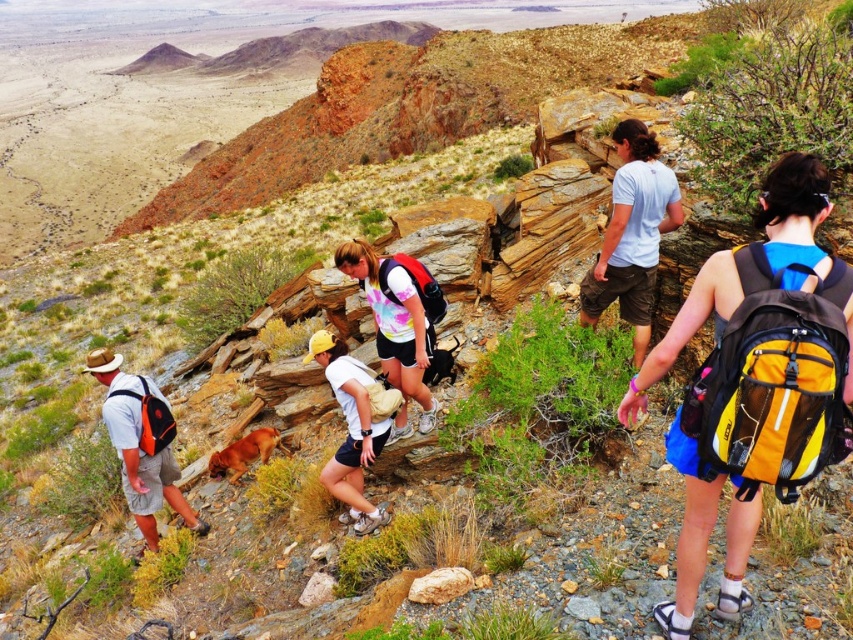
Consider the image. Is light blue t-shirt at upper right above white fabric shirt at center?

Correct, light blue t-shirt at upper right is located above white fabric shirt at center.

Can you confirm if light blue t-shirt at upper right is smaller than white fabric shirt at center?

Actually, light blue t-shirt at upper right might be larger than white fabric shirt at center.

At what (x,y) coordinates should I click in order to perform the action: click on light blue t-shirt at upper right. Please return your answer as a coordinate pair (x, y). The height and width of the screenshot is (640, 853). Looking at the image, I should click on click(x=631, y=234).

Does orange fabric backpack at left have a smaller size compared to brown furry dog at lower center?

No, orange fabric backpack at left is not smaller than brown furry dog at lower center.

Is orange fabric backpack at left thinner than brown furry dog at lower center?

Yes.

Is point (123, 454) closer to viewer compared to point (213, 472)?

Yes, it is in front of point (213, 472).

Find the location of a particular element. The width and height of the screenshot is (853, 640). orange fabric backpack at left is located at coordinates (141, 444).

Is light blue t-shirt at upper right further to camera compared to white tie-dye t-shirt at center?

That is False.

Is point (648, 237) more distant than point (393, 371)?

No.

Is point (619, 308) less distant than point (374, 256)?

No, it is behind (374, 256).

What are the coordinates of `light blue t-shirt at upper right` in the screenshot? It's located at (631, 234).